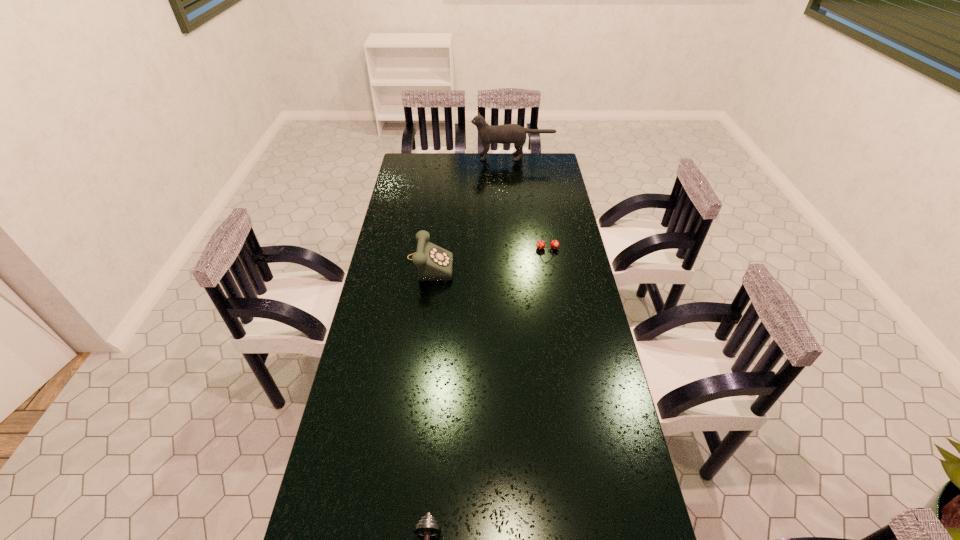
The height and width of the screenshot is (540, 960). Identify the location of object situated at the left edge. (434, 263).

You are a GUI agent. You are given a task and a screenshot of the screen. Output one action in this format:
    pyautogui.click(x=<x>, y=<y>)
    Task: Click on the cat located in the right edge section of the desktop
    
    Given the screenshot: What is the action you would take?
    (510, 133)

Locate an element on the screen. The width and height of the screenshot is (960, 540). cherry present at the right edge is located at coordinates (554, 244).

Where is `object that is at the far right corner`? This screenshot has height=540, width=960. object that is at the far right corner is located at coordinates (510, 133).

The height and width of the screenshot is (540, 960). In the image, there is a desktop. What are the coordinates of `vacant region at the far edge` in the screenshot? It's located at (436, 155).

I want to click on vacant area at the left edge of the desktop, so click(x=393, y=305).

Locate an element on the screen. blank space at the right edge of the desktop is located at coordinates (576, 439).

You are a GUI agent. You are given a task and a screenshot of the screen. Output one action in this format:
    pyautogui.click(x=<x>, y=<y>)
    Task: Click on the vacant space at the far left corner
    
    Given the screenshot: What is the action you would take?
    pyautogui.click(x=410, y=161)

Find the location of a particular element. vacant point at the far right corner is located at coordinates (541, 159).

Find the location of `unoccupied area between the farthest object and the third tallest object`. unoccupied area between the farthest object and the third tallest object is located at coordinates (530, 203).